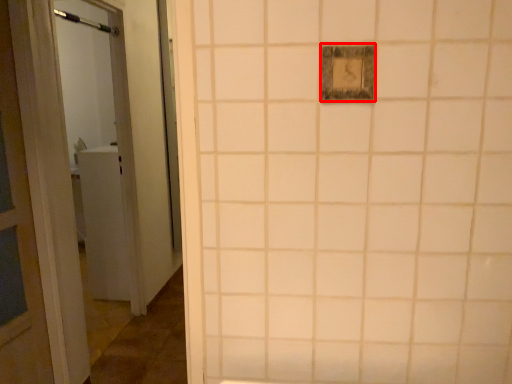
Question: Where is light switch (annotated by the red box) located in relation to shower in the image?

Choices:
 (A) right
 (B) left

Answer: (A)